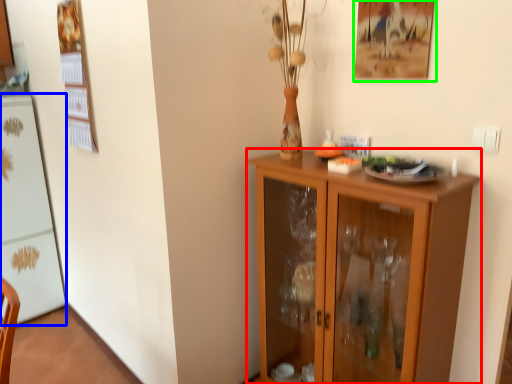
Question: Which is farther away from cupboard (highlighted by a red box)? appliance (highlighted by a blue box) or picture frame (highlighted by a green box)?

Choices:
 (A) appliance
 (B) picture frame

Answer: (A)